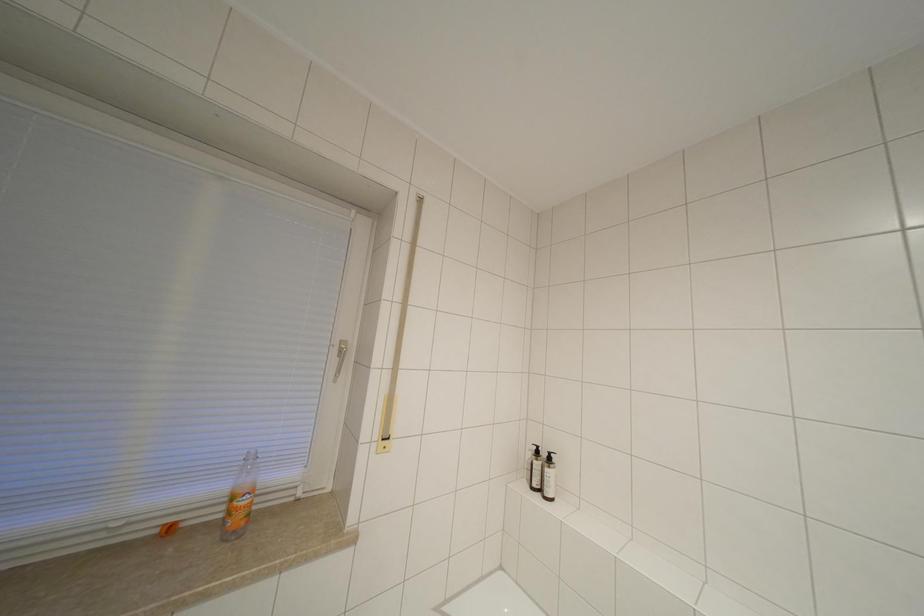
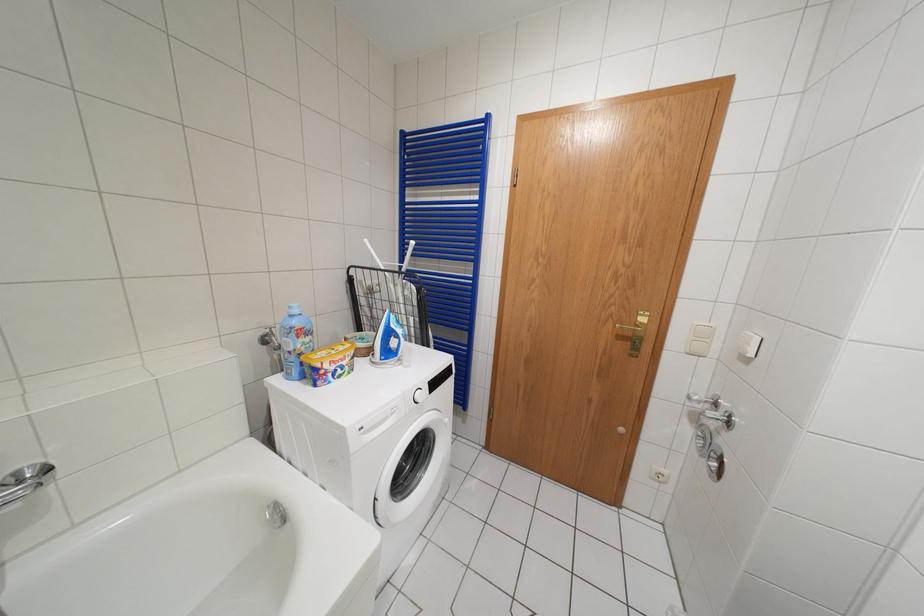
Question: Based on the continuous images, in which direction is the camera rotating? Reply with the corresponding letter.

Choices:
 (A) Left
 (B) Right
 (C) Up
 (D) Down

Answer: (B)